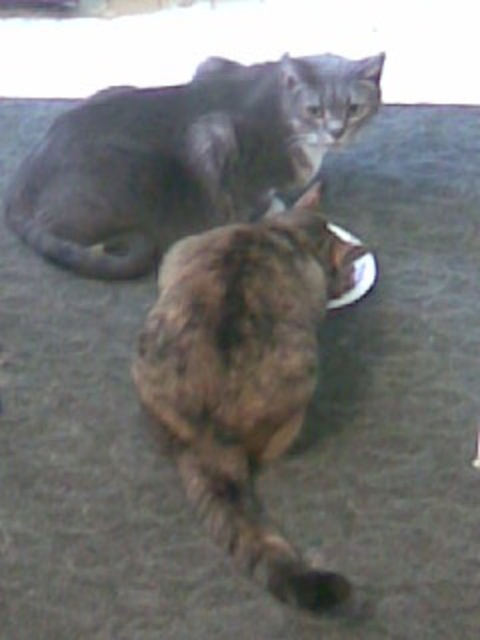
You are a photographer trying to capture both the gray fur cat at upper center and the brown fur cat at center in a single frame. Based on their positions and sizes, which cat would appear larger in the photo?

The gray fur cat at upper center might be wider than brown fur cat at center, so it would appear larger in the photo.

You are a photographer trying to capture both the brown fur cat at center and the metallic reflective plate at center in a single shot. Based on their positions, which object should you adjust your camera angle to focus on first to ensure both are in frame?

The brown fur cat at center is positioned on the left side of the metallic reflective plate at center. To ensure both are in frame, you should first focus on the metallic reflective plate at center since it is on the right, then adjust the angle to include the brown fur cat at center on the left.